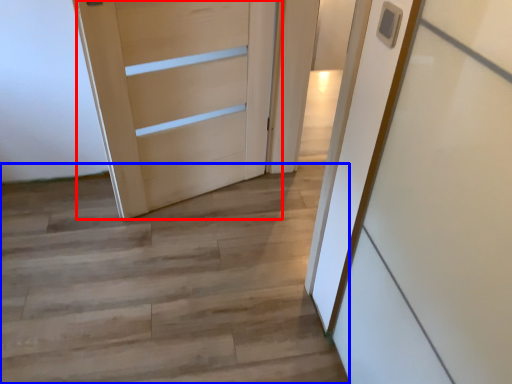
Question: Which object is closer to the camera taking this photo, door (highlighted by a red box) or stairwell (highlighted by a blue box)?

Choices:
 (A) door
 (B) stairwell

Answer: (B)